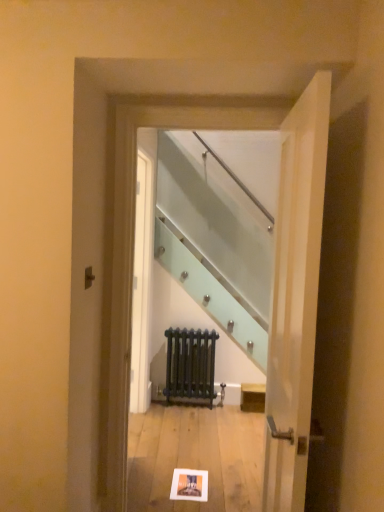
At what (x,y) coordinates should I click in order to perform the action: click on vacant space in front of matte black radiator at center. Please return your answer as a coordinate pair (x, y). This screenshot has height=512, width=384. Looking at the image, I should click on (188, 414).